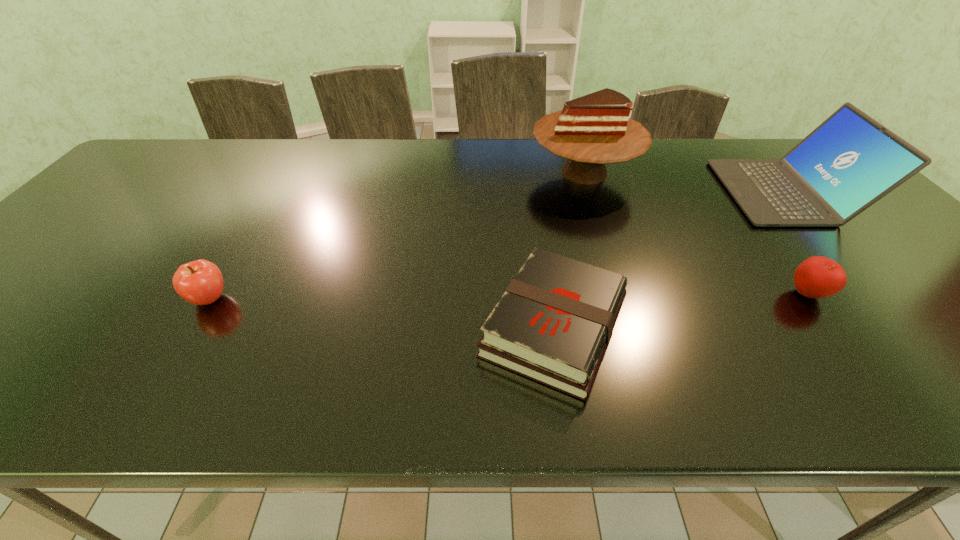
You are a GUI agent. You are given a task and a screenshot of the screen. Output one action in this format:
    pyautogui.click(x=<x>, y=<y>)
    Task: Click on the empty space that is in between the laptop computer and the hardback book
    
    Given the screenshot: What is the action you would take?
    [x=670, y=259]

Where is `free space between the cake and the shortest object`? free space between the cake and the shortest object is located at coordinates (569, 249).

Where is `object that is the fourth closest to the hardback book`? The height and width of the screenshot is (540, 960). object that is the fourth closest to the hardback book is located at coordinates (200, 282).

Find the location of a particular element. the closest object to the hardback book is located at coordinates (593, 130).

Locate an element on the screen. Image resolution: width=960 pixels, height=540 pixels. free spot that satisfies the following two spatial constraints: 1. on the front side of the cake; 2. on the right side of the right apple is located at coordinates click(624, 294).